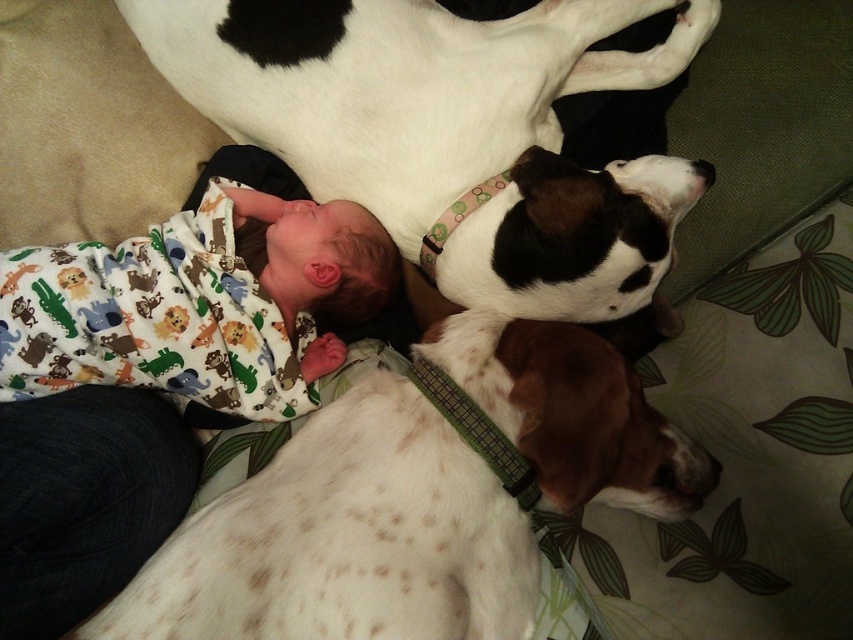
You are a photographer trying to capture a closeup of the white speckled fur at upper center and the speckled white dog at lower left. Which one should you focus on first to ensure it appears sharp in the photo?

You should focus on the white speckled fur at upper center first because it is closer to the viewer than the speckled white dog at lower left, ensuring it will be in sharp focus.